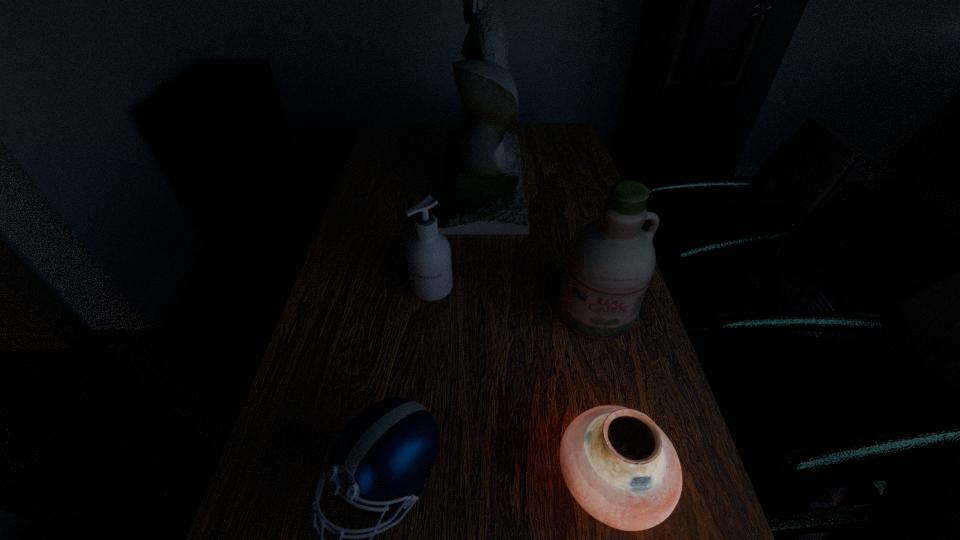
Where is `free space between the right cleansing agent and the sculpture`? free space between the right cleansing agent and the sculpture is located at coordinates (539, 246).

Where is `free space between the sculpture and the taller cleansing agent`? free space between the sculpture and the taller cleansing agent is located at coordinates (539, 246).

Image resolution: width=960 pixels, height=540 pixels. In order to click on the second closest object to the third tallest object in this screenshot , I will do `click(610, 261)`.

Identify the location of the fourth closest object to the taller cleansing agent. The image size is (960, 540). click(384, 455).

You are a GUI agent. You are given a task and a screenshot of the screen. Output one action in this format:
    pyautogui.click(x=<x>, y=<y>)
    Task: Click on the free space that satisfies the following two spatial constraints: 1. on the base of the farthest object; 2. on the front label of the third shortest object
    The image size is (960, 540).
    Given the screenshot: What is the action you would take?
    pyautogui.click(x=484, y=288)